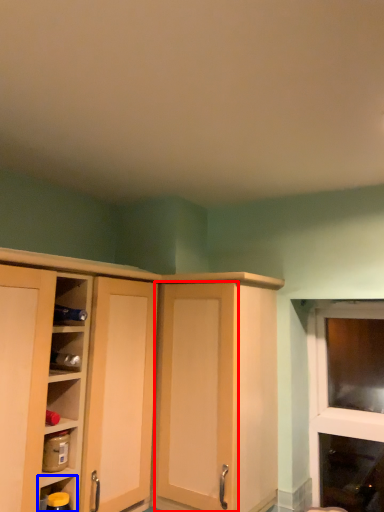
Question: Which object is closer to the camera taking this photo, screen door (highlighted by a red box) or shelf (highlighted by a blue box)?

Choices:
 (A) screen door
 (B) shelf

Answer: (B)